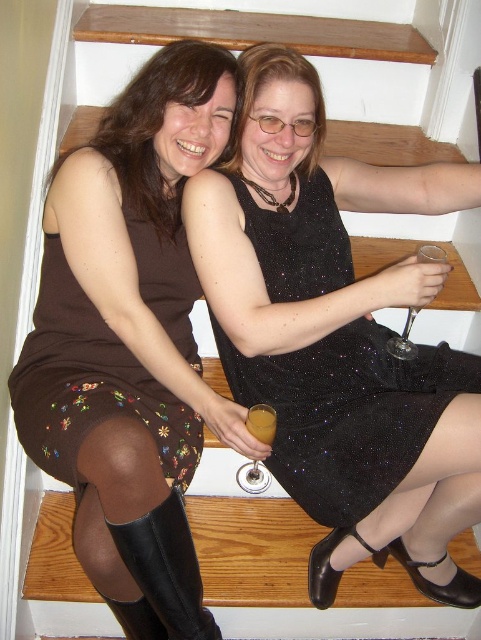
Can you confirm if matte brown dress at center is bigger than sparkly black dress at center?

Indeed, matte brown dress at center has a larger size compared to sparkly black dress at center.

Does matte brown dress at center have a lesser height compared to sparkly black dress at center?

In fact, matte brown dress at center may be taller than sparkly black dress at center.

Is point (139, 241) less distant than point (342, 355)?

Yes.

This screenshot has height=640, width=481. In order to click on matte brown dress at center in this screenshot , I will do `click(131, 340)`.

Does black leather boot at lower left have a lesser height compared to clear glass wine glass at center?

No.

Can you confirm if black leather boot at lower left is thinner than clear glass wine glass at center?

No, black leather boot at lower left is not thinner than clear glass wine glass at center.

In order to click on black leather boot at lower left in this screenshot , I will do `click(163, 576)`.

In order to click on black leather boot at lower left in this screenshot , I will do `click(163, 576)`.

Looking at this image, between matte brown dress at upper left and translucent glass at upper center, which one is positioned higher?

matte brown dress at upper left

Does point (91, 145) come in front of point (268, 408)?

No, (91, 145) is behind (268, 408).

Identify the location of matte brown dress at upper left. The width and height of the screenshot is (481, 640). (161, 125).